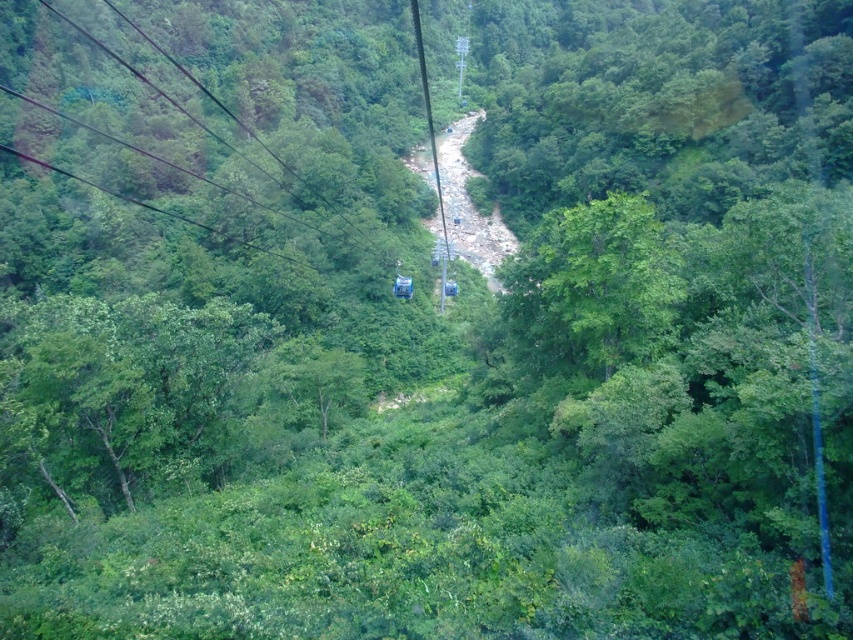
Does black wire at upper left appear on the right side of metallic wire at center?

In fact, black wire at upper left is to the left of metallic wire at center.

Between point (335, 180) and point (430, 148), which one is positioned in front?

Point (335, 180)

Is point (143, 104) positioned after point (442, 272)?

Yes, point (143, 104) is farther from viewer.

In order to click on black wire at upper left in this screenshot , I will do `click(270, 102)`.

Is green leafy tree at center thinner than metallic wire at center?

No.

Which is in front, point (595, 317) or point (418, 52)?

Point (595, 317)

The height and width of the screenshot is (640, 853). What do you see at coordinates (593, 288) in the screenshot? I see `green leafy tree at center` at bounding box center [593, 288].

You are a GUI agent. You are given a task and a screenshot of the screen. Output one action in this format:
    pyautogui.click(x=<x>, y=<y>)
    Task: Click on the green leafy tree at center
    This screenshot has height=640, width=853.
    Given the screenshot: What is the action you would take?
    pyautogui.click(x=593, y=288)

Is point (149, 196) positioned behind point (558, 298)?

Yes, point (149, 196) is farther from viewer.

Can you confirm if black wire at upper left is shorter than green leafy tree at center?

In fact, black wire at upper left may be taller than green leafy tree at center.

Locate an element on the screen. The width and height of the screenshot is (853, 640). black wire at upper left is located at coordinates (270, 102).